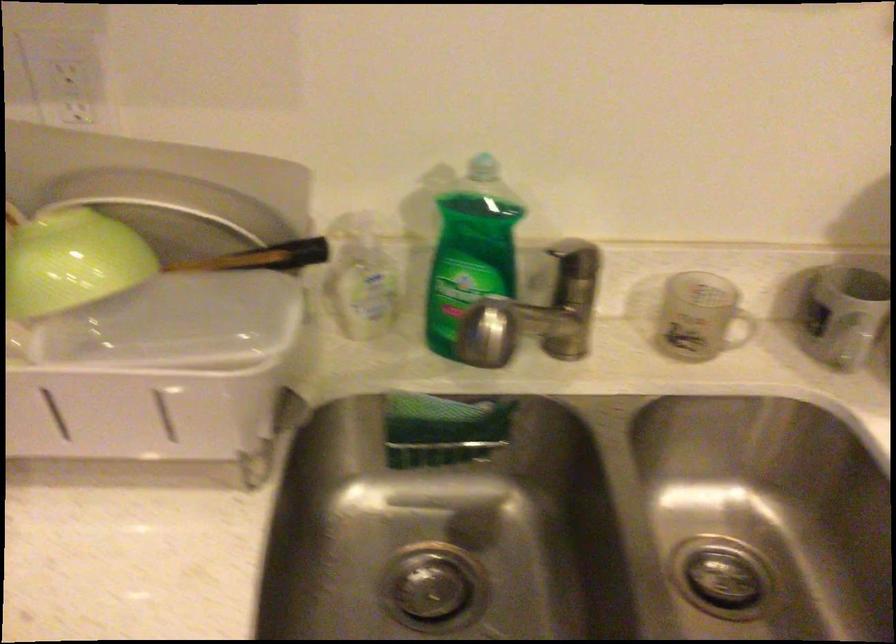
What do you see at coordinates (739, 328) in the screenshot? I see `the clear mug handle` at bounding box center [739, 328].